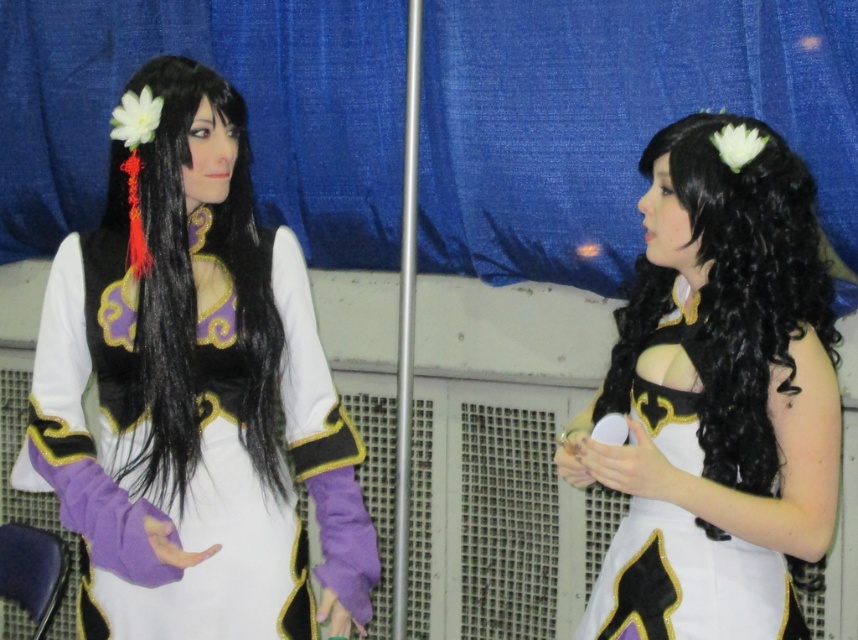
Please describe the exact location of the white matte dress at center in the image using coordinate points. The coordinate system has the origin at the bottom left corner of the image, with the x and y axes increasing to the right and up respectively. The maximum x and y values are both 1.0. Please provide the coordinates as a pair in parentheses, like this example format for a different object at position 0.3,0.7 would be written as follows. The position of example object is at point 0.3,0.7. So the answer

The white matte dress at center is located at coordinates 0.559 in the x direction and 0.847 in the y direction. Since the coordinate system has the origin at the bottom left corner, this means the white matte dress at center is positioned slightly to the right of the center horizontally and closer to the bottom vertically.

You are standing at the camera position and want to take a photo of the point at coordinate point (726, 298). Can you reach it with your hand if you extend your arm fully? Assume your arm is 0.7 meters long.

The point at coordinate point (726, 298) is 2.28 meters away from the camera, which is farther than your arm length of 0.7 meters. Therefore, you cannot reach it with your hand.

You are a photographer at a cosplay event and want to ensure both the matte black dress at center and the white matte dress at center are visible in your photo. Based on their positions, which dress is covering part of the other?

The matte black dress at center is positioned over the white matte dress at center, so it is covering part of it.